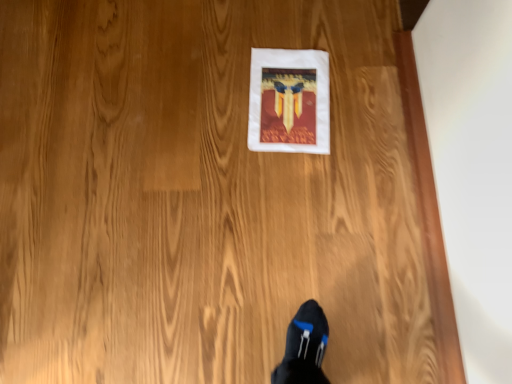
Image resolution: width=512 pixels, height=384 pixels. In order to click on free spot behind matte paper comic book at center in this screenshot , I will do `click(298, 21)`.